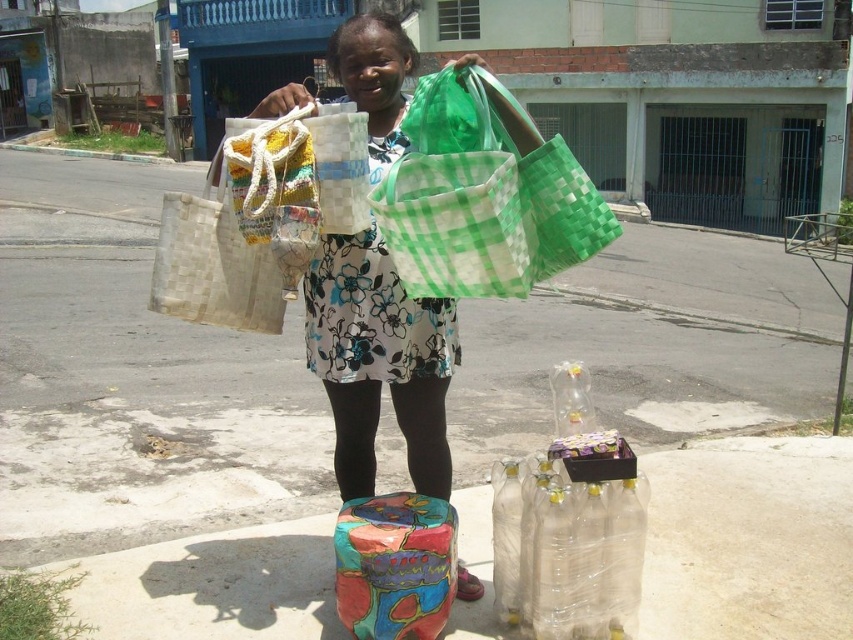
Can you confirm if matte woven bags at center is thinner than painted fabric bag at center?

In fact, matte woven bags at center might be wider than painted fabric bag at center.

Who is more forward, (x=392, y=132) or (x=432, y=381)?

Point (x=392, y=132) is in front.

Does point (343, 74) lie behind point (437, 488)?

No.

The height and width of the screenshot is (640, 853). Identify the location of matte woven bags at center. (379, 362).

Can you confirm if green woven bag at center is wider than painted fabric bag at center?

Correct, the width of green woven bag at center exceeds that of painted fabric bag at center.

Find the location of a particular element. Image resolution: width=853 pixels, height=640 pixels. green woven bag at center is located at coordinates [x=482, y=196].

Can you confirm if matte woven bags at center is taller than green woven bag at center?

Correct, matte woven bags at center is much taller as green woven bag at center.

Which is in front, point (340, 417) or point (440, 196)?

Point (440, 196) is in front.

Measure the distance between point (424, 460) and camera.

Point (424, 460) is 9.81 feet from camera.

This screenshot has width=853, height=640. What are the coordinates of `matte woven bags at center` in the screenshot? It's located at (379, 362).